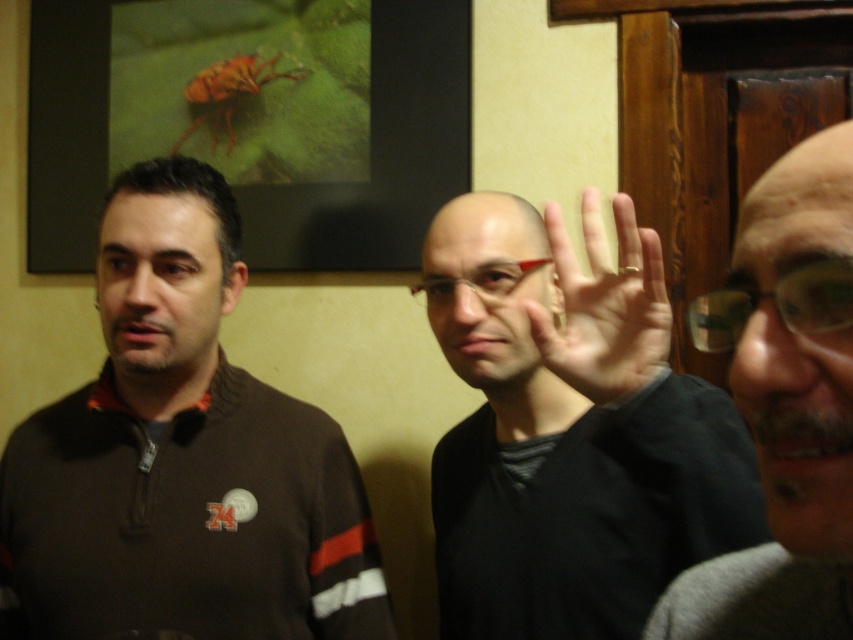
Does dark brown sweater at left have a lesser height compared to orange matte insect at upper left?

No.

Which of these two, dark brown sweater at left or orange matte insect at upper left, stands taller?

dark brown sweater at left

Where is `dark brown sweater at left`? dark brown sweater at left is located at coordinates (183, 456).

Where is `dark brown sweater at left`? dark brown sweater at left is located at coordinates (183, 456).

Locate an element on the screen. matte black glasses at center is located at coordinates (480, 234).

Who is higher up, matte black glasses at center or transparent plastic glasses at center?

transparent plastic glasses at center

Is point (451, 339) positioned after point (514, 282)?

Yes, point (451, 339) is behind point (514, 282).

Locate an element on the screen. The width and height of the screenshot is (853, 640). matte black glasses at center is located at coordinates (480, 234).

Can you confirm if clear plastic glasses at upper right is smaller than transparent plastic glasses at center?

Correct, clear plastic glasses at upper right occupies less space than transparent plastic glasses at center.

Is point (821, 273) positioned behind point (428, 304)?

No, it is in front of (428, 304).

Who is more distant from viewer, (820,273) or (445,276)?

Point (445,276)

At what (x,y) coordinates should I click in order to perform the action: click on clear plastic glasses at upper right. Please return your answer as a coordinate pair (x, y). The height and width of the screenshot is (640, 853). Looking at the image, I should click on (776, 305).